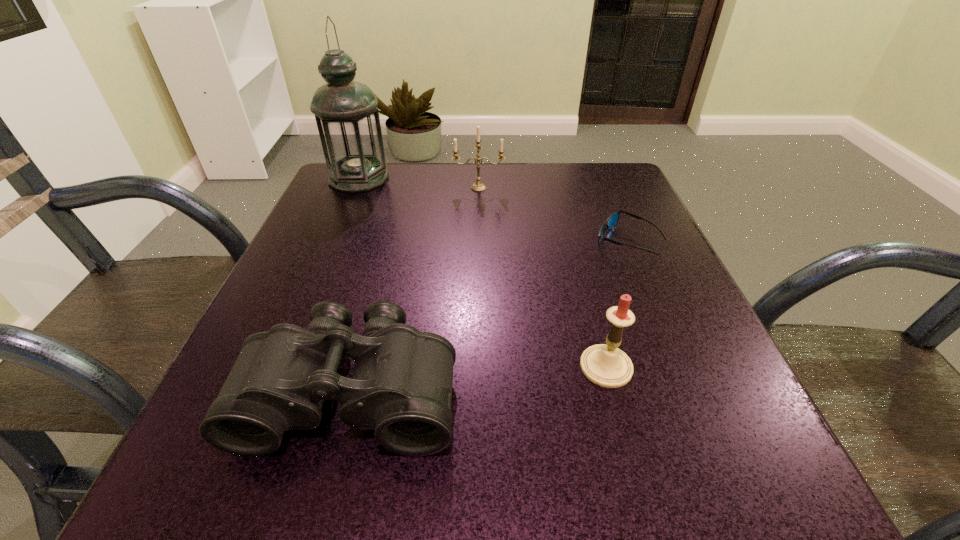
Find the location of a particular element. object located at the far left corner is located at coordinates pos(346,113).

Where is `object that is at the near left corner`? object that is at the near left corner is located at coordinates (401, 386).

Find the location of a particular element. This screenshot has width=960, height=540. free region at the far edge of the desktop is located at coordinates (500, 167).

This screenshot has width=960, height=540. In the image, there is a desktop. What are the coordinates of `free space at the near edge` in the screenshot? It's located at 588,482.

At what (x,y) coordinates should I click in order to perform the action: click on free spot at the left edge of the desktop. Please return your answer as a coordinate pair (x, y). The height and width of the screenshot is (540, 960). Looking at the image, I should click on (340, 267).

Identify the location of vacant space at the right edge of the desktop. (647, 324).

The height and width of the screenshot is (540, 960). Find the location of `vacant space at the far left corner`. vacant space at the far left corner is located at coordinates (x=348, y=195).

The height and width of the screenshot is (540, 960). I want to click on free space at the far right corner, so click(x=616, y=176).

What are the coordinates of `vacant area at the near right corner of the desktop` in the screenshot? It's located at (670, 442).

Locate an element on the screen. The image size is (960, 540). free space between the tallest object and the shortest object is located at coordinates (492, 210).